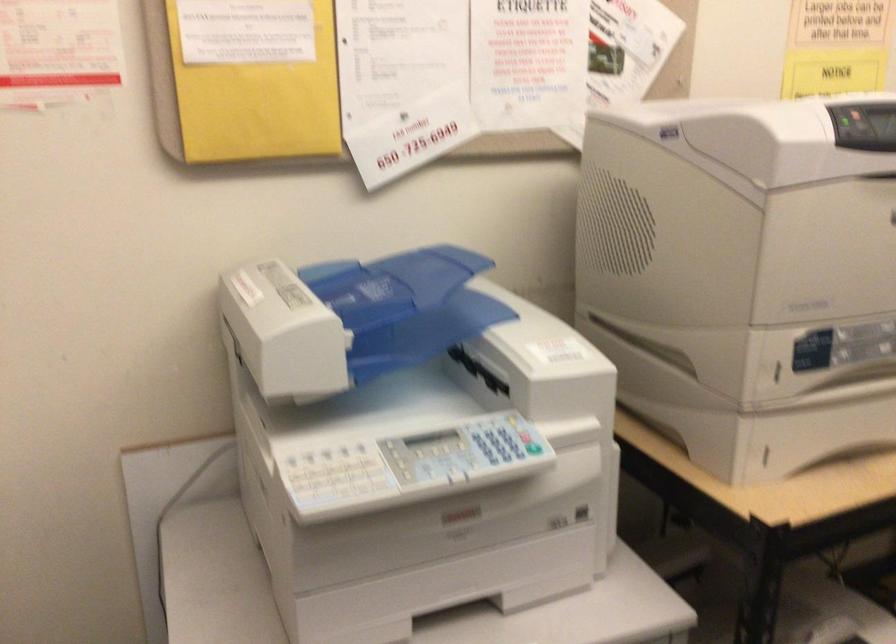
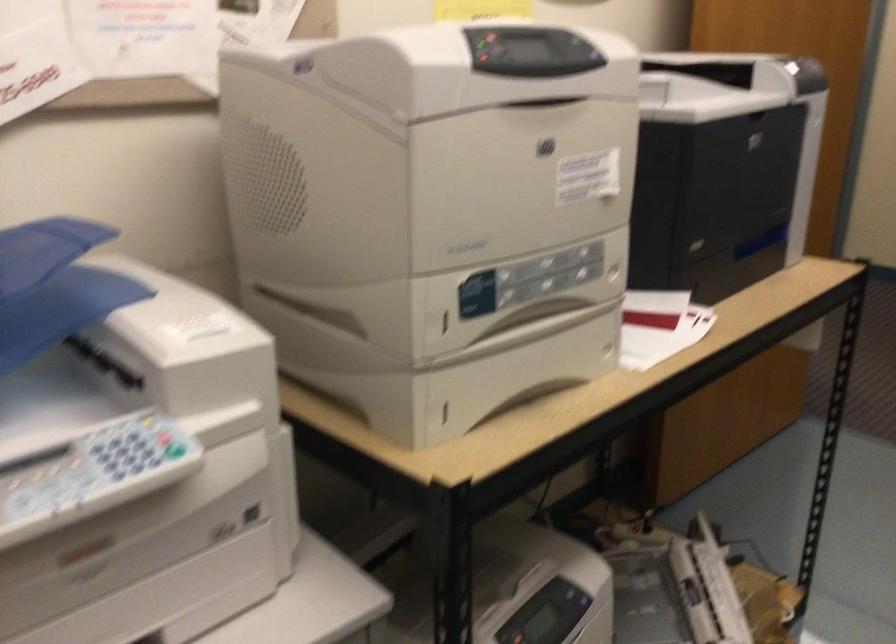
Question: The images are taken continuously from a first-person perspective. In which direction is your viewpoint rotating?

Choices:
 (A) Left
 (B) Right
 (C) Up
 (D) Down

Answer: (B)